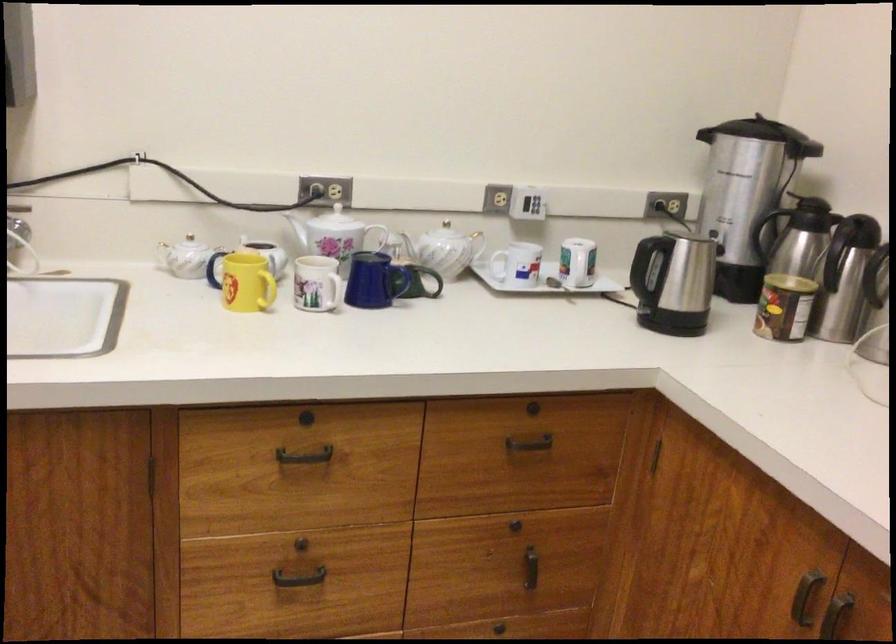
This screenshot has height=644, width=896. I want to click on yellow mug handle, so click(268, 289).